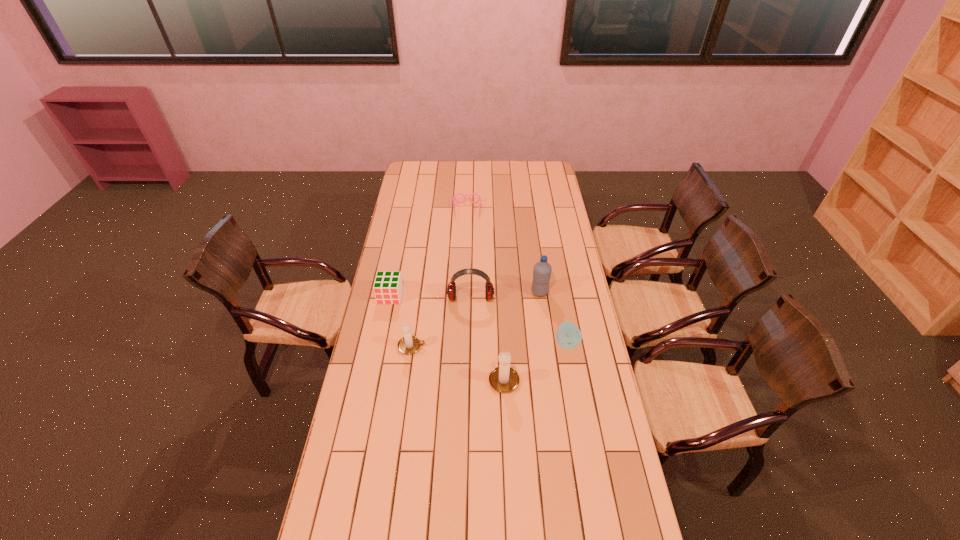
Find the location of a particular element. This screenshot has height=540, width=960. vacant area in the image that satisfies the following two spatial constraints: 1. on the ear cups of the apple; 2. on the left side of the earphone is located at coordinates (469, 343).

At what (x,y) coordinates should I click in order to perform the action: click on free space that satisfies the following two spatial constraints: 1. on the arms of the tallest object; 2. on the left side of the farthest object. Please return your answer as a coordinate pair (x, y). This screenshot has width=960, height=540. Looking at the image, I should click on (464, 292).

The image size is (960, 540). What are the coordinates of `free space that satisfies the following two spatial constraints: 1. on the handle side of the nearer candle holder; 2. on the handle side of the farther candle holder` in the screenshot? It's located at (502, 347).

This screenshot has width=960, height=540. In order to click on free spot that satisfies the following two spatial constraints: 1. on the ear cups of the earphone; 2. on the handle side of the farther candle holder in this screenshot , I will do `click(469, 347)`.

At what (x,y) coordinates should I click in order to perform the action: click on free spot that satisfies the following two spatial constraints: 1. on the handle side of the nearest object; 2. on the handle side of the shorter candle holder. Please return your answer as a coordinate pair (x, y). Looking at the image, I should click on (502, 347).